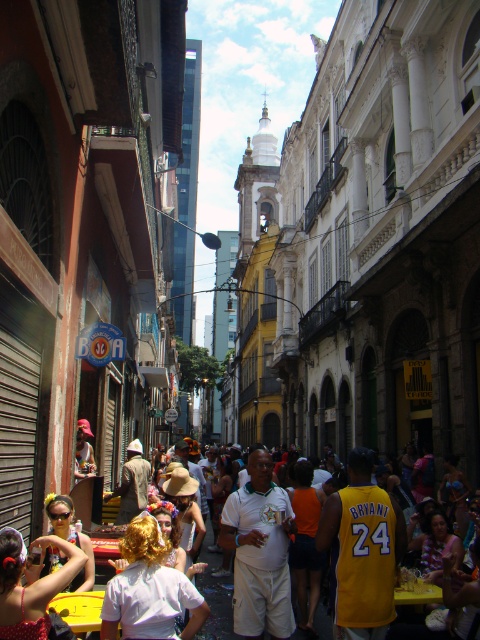
You are standing on the street and see a white matte shirt at center. There is a red hat 120.57 feet away from it. Can you see the red hat from where you are standing?

The red hat is 120.57 feet away from the white matte shirt at center, so yes, you can see the red hat from where you are standing as there are no obstructions mentioned in the scene description.